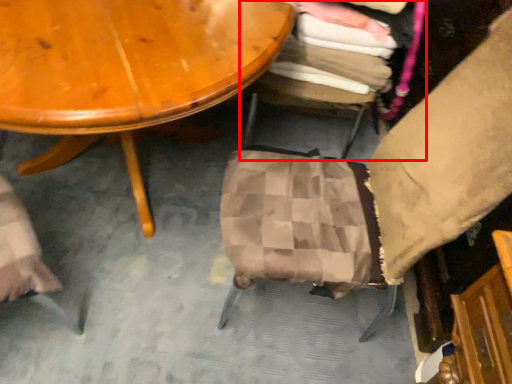
Question: From the image's perspective, what is the correct spatial relationship of chair (annotated by the red box) in relation to chair?

Choices:
 (A) below
 (B) above

Answer: (B)